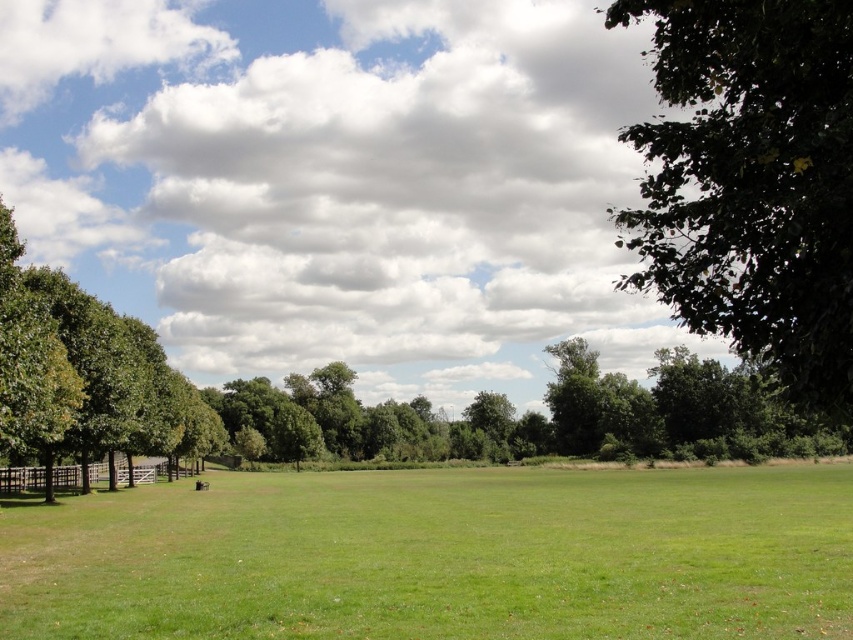
Question: Observing the image, what is the correct spatial positioning of green grassy field at center in reference to green leafy tree at upper right?

Choices:
 (A) left
 (B) right

Answer: (A)

Question: Which point appears closest to the camera in this image?

Choices:
 (A) (749, 77)
 (B) (659, 486)

Answer: (A)

Question: From the image, what is the correct spatial relationship of green grassy field at center in relation to green leafy tree at upper right?

Choices:
 (A) right
 (B) left

Answer: (B)

Question: From the image, what is the correct spatial relationship of green grassy field at center in relation to green leafy tree at upper right?

Choices:
 (A) left
 (B) right

Answer: (A)